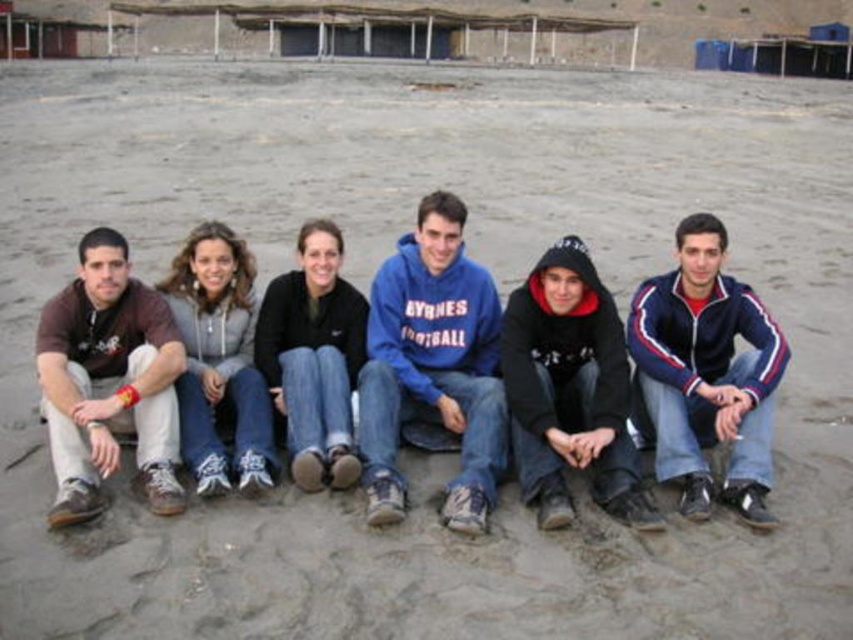
You are standing in front of the group of six people sitting on the sandy surface. You notice two points marked in the image. The first point is at coordinates point [747,518] and the second point is at point [202,422]. Which of these two points is closer to you?

Point [747,518] is closer to the camera than point [202,422], so the first point is closer to you.